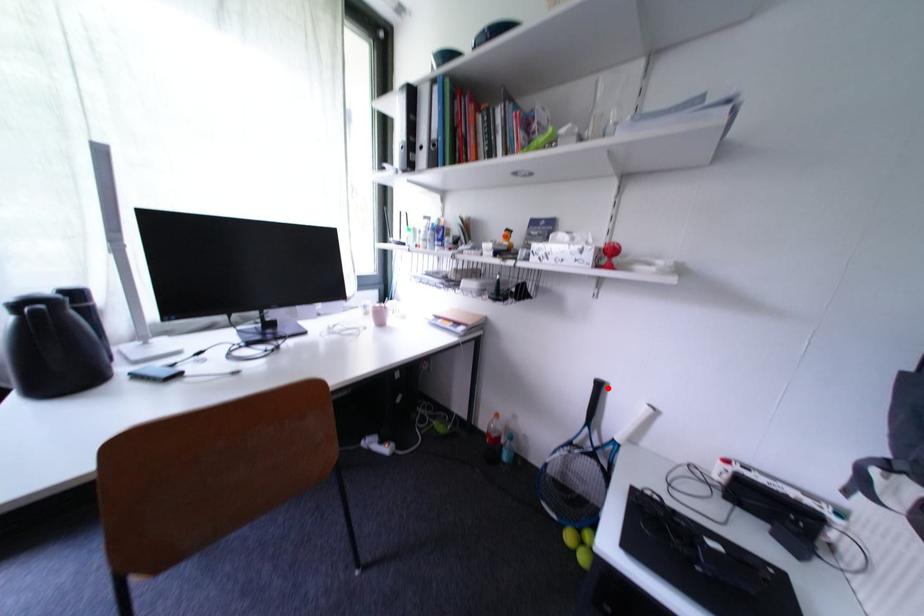
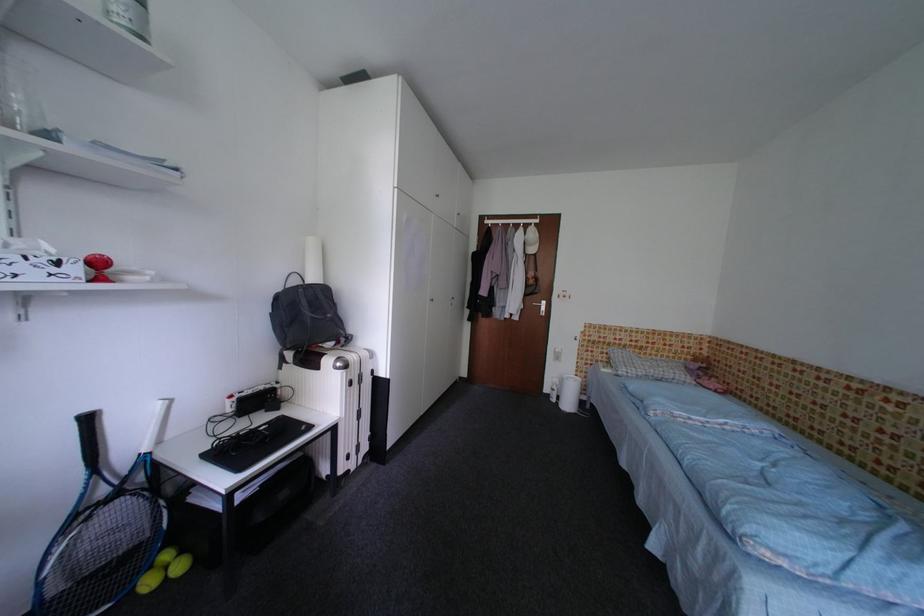
In the second image, find the point that corresponds to the highlighted location in the first image.

(98, 422)